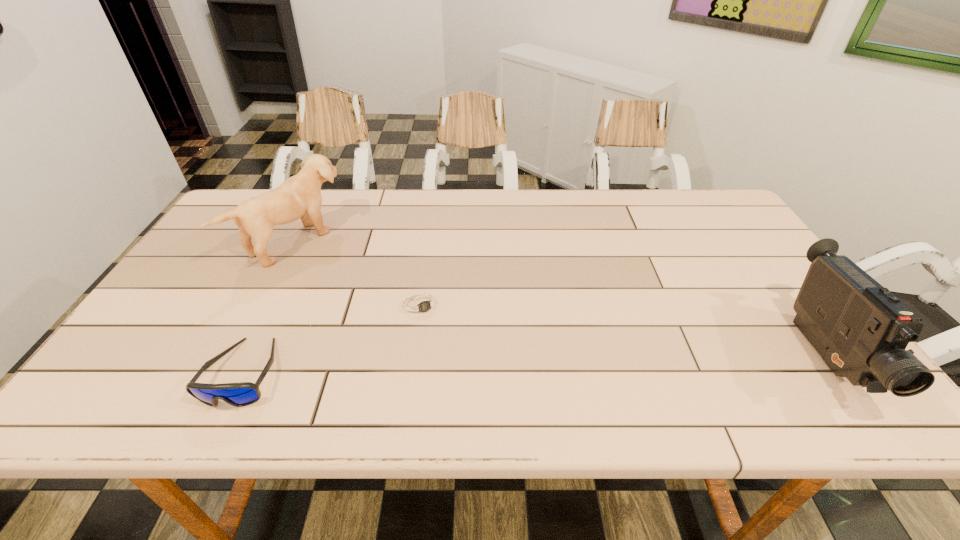
Image resolution: width=960 pixels, height=540 pixels. I want to click on object that is at the far edge, so click(x=299, y=196).

At what (x,y) coordinates should I click in order to perform the action: click on sunglasses that is at the near edge. Please return your answer as a coordinate pair (x, y). This screenshot has height=540, width=960. Looking at the image, I should click on (240, 394).

Find the location of a particular element. camcorder that is positioned at the near edge is located at coordinates point(861,330).

Where is `object situated at the left edge`? This screenshot has height=540, width=960. object situated at the left edge is located at coordinates (299, 196).

You are a GUI agent. You are given a task and a screenshot of the screen. Output one action in this format:
    pyautogui.click(x=<x>, y=<y>)
    Task: Click on the object present at the right edge
    This screenshot has width=960, height=540.
    Given the screenshot: What is the action you would take?
    pyautogui.click(x=861, y=330)

The width and height of the screenshot is (960, 540). In order to click on object that is positioned at the far left corner in this screenshot , I will do `click(299, 196)`.

This screenshot has width=960, height=540. In order to click on object located at the near right corner in this screenshot , I will do `click(861, 330)`.

At what (x,y) coordinates should I click in order to perform the action: click on vacant region at the far edge of the desktop. Please return your answer as a coordinate pair (x, y). The height and width of the screenshot is (540, 960). Looking at the image, I should click on (391, 227).

In the image, there is a desktop. Identify the location of free space at the near edge. (299, 346).

The height and width of the screenshot is (540, 960). I want to click on vacant space at the left edge of the desktop, so click(234, 250).